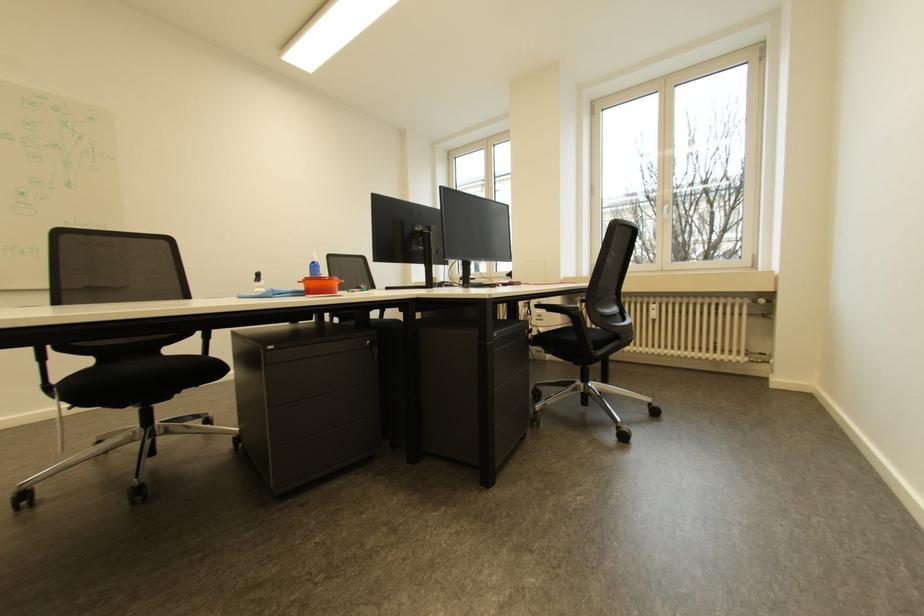
Locate an element on the screen. radiator valve knob is located at coordinates (762, 305).